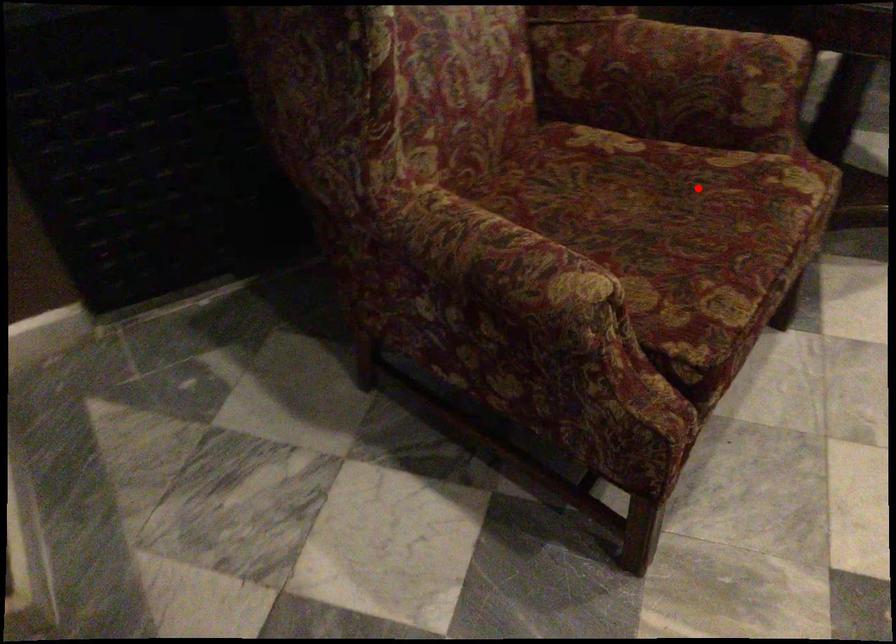
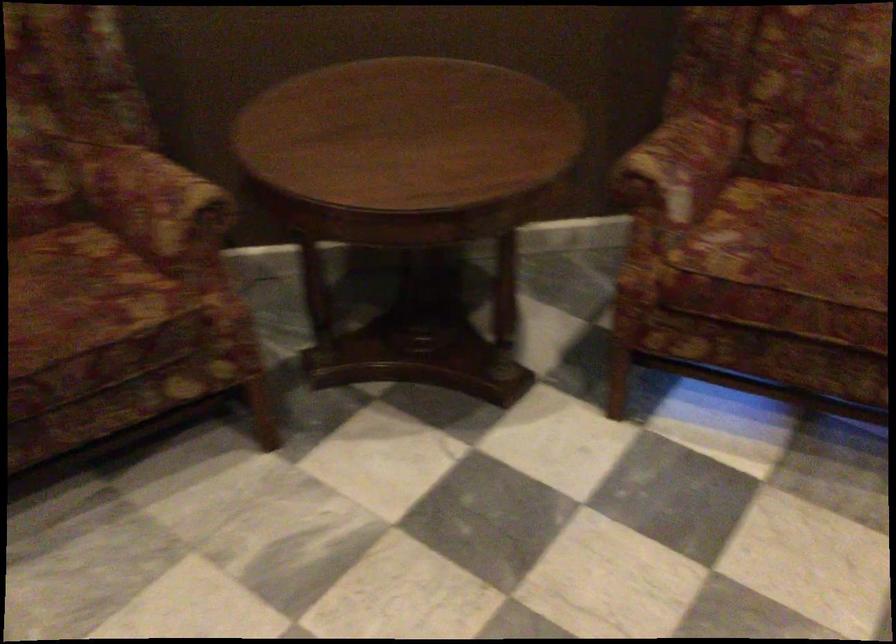
Locate, in the second image, the point that corresponds to the highlighted location in the first image.

(80, 292)